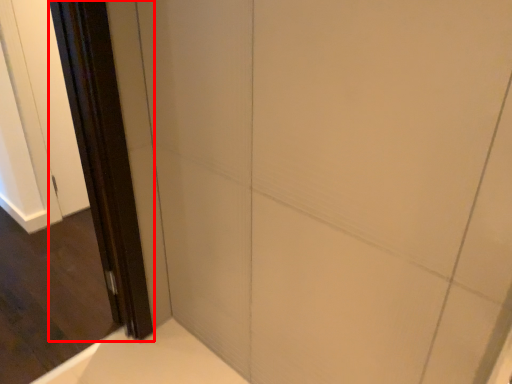
Question: From the image's perspective, what is the correct spatial relationship of screen door (annotated by the red box) in relation to screen door?

Choices:
 (A) below
 (B) above

Answer: (B)